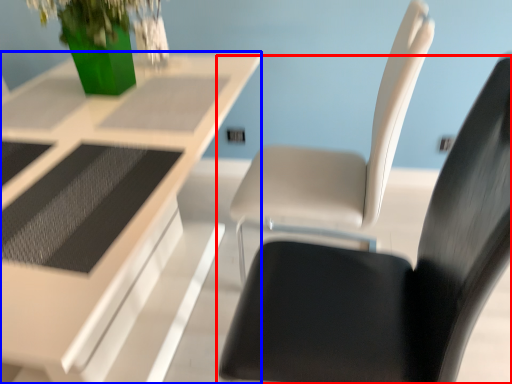
Question: Among these objects, which one is nearest to the camera, chair (highlighted by a red box) or table (highlighted by a blue box)?

Choices:
 (A) chair
 (B) table

Answer: (A)